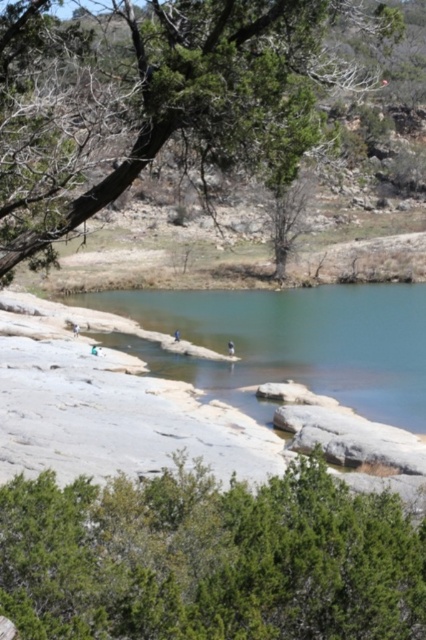
You are standing at the edge of the water and want to take a photo of the green leafy tree at upper left and the clear blue water at center. Which object should you pan your camera to the left to capture first?

You should pan your camera to the left to capture the green leafy tree at upper left first because it is positioned to the left of the clear blue water at center.

You are a hiker who wants to take a photo of the clear blue water at center without the green leafy tree at upper left blocking the view. Is there a way to position yourself so that the tree is not in the frame?

The green leafy tree at upper left is positioned over the clear blue water at center, so if you move to a lower position or shift your angle to the side, you might be able to avoid the tree blocking the view of the water.

You are a hiker standing at the edge of the rocky shoreline. You need to determine which object, the green leafy bush at center or the clear blue water at center, is shorter in height. Which one is shorter?

The green leafy bush at center is not as tall as clear blue water at center, so the green leafy bush at center is shorter in height.